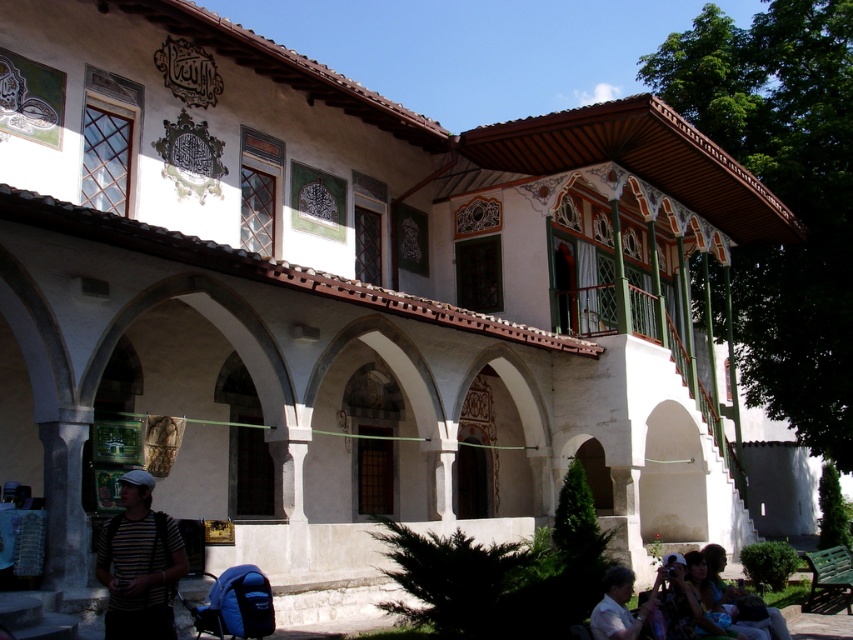
You are standing in front of the building and see two people wearing shirts. One is wearing a striped fabric shirt at lower left and the other a matte black shirt at lower right. Which shirt is positioned higher up relative to the building?

The striped fabric shirt at lower left is located above the matte black shirt at lower right, so the striped fabric shirt at lower left is positioned higher up relative to the building.

Based on the photo, you are standing in front of a historical building with arches and columns. You see a light brown leather jacket at lower right. Where exactly is the light brown leather jacket located in terms of coordinates?

The light brown leather jacket at lower right is located at coordinates point (618,608).

You are standing in front of the building and want to locate the striped fabric shirt at lower left. Based on its 2D coordinates, where exactly should you look on the image?

The striped fabric shirt at lower left is located at the 2D coordinates point (138, 564) on the image.